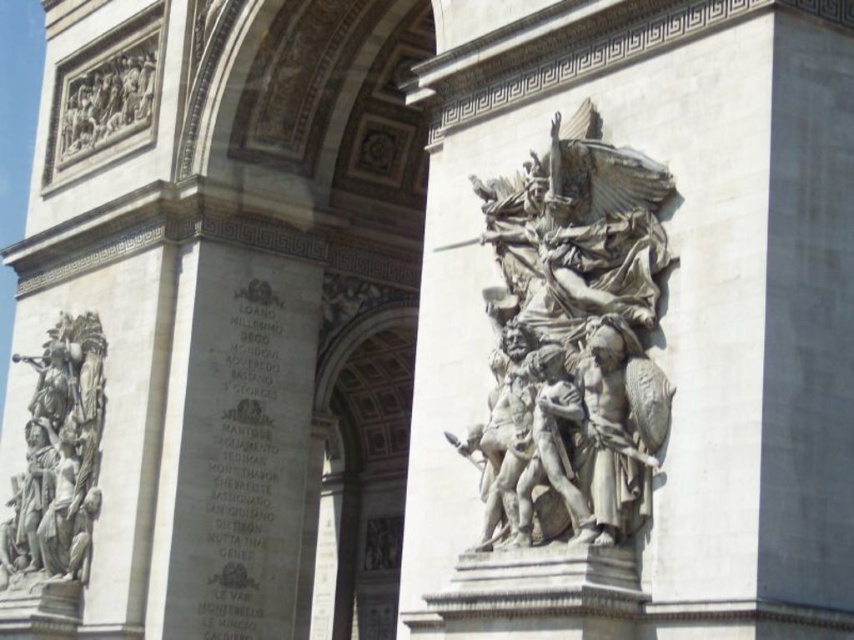
You are standing at the base of the Arc de Triomphe and want to know how far the point at coordinates (457, 401) is from you. Can you determine the distance?

The point at coordinates (457, 401) is 42.41 meters away from the viewer.

You are an art student analyzing the sculptures on the Arc de Triomphe. You observe the white stone sculpture at center and the stone relief figures at left. Which sculpture is taller?

The white stone sculpture at center is taller than the stone relief figures at left.